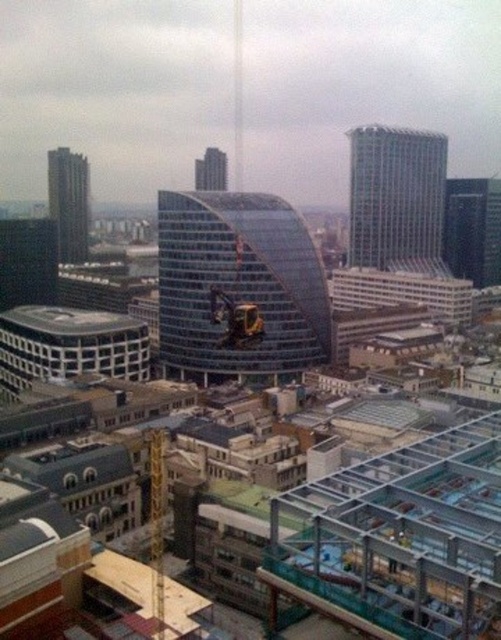
What do you see at coordinates (69, 202) in the screenshot? Image resolution: width=501 pixels, height=640 pixels. I see `dark gray glass skyscraper at upper left` at bounding box center [69, 202].

Locate an element on the screen. dark gray glass skyscraper at upper left is located at coordinates (69, 202).

Can you confirm if dark gray glass skyscraper at right is positioned to the right of glassy steel skyscraper at center?

Yes, dark gray glass skyscraper at right is to the right of glassy steel skyscraper at center.

Is point (448, 208) in front of point (216, 176)?

Yes.

The image size is (501, 640). I want to click on dark gray glass skyscraper at right, so [x=472, y=228].

Can you confirm if transparent glass building at center is positioned above dark gray glass skyscraper at upper left?

Actually, transparent glass building at center is below dark gray glass skyscraper at upper left.

Who is more forward, (237, 230) or (70, 202)?

Positioned in front is point (237, 230).

Based on the photo, measure the distance between point (194,324) and camera.

Point (194,324) and camera are 277.60 meters apart.

This screenshot has height=640, width=501. I want to click on transparent glass building at center, so click(238, 284).